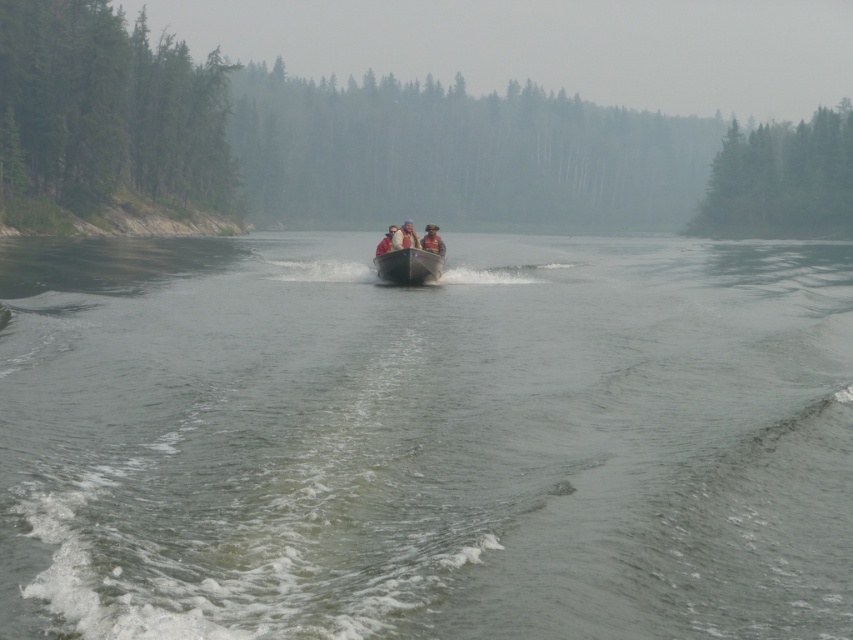
You are a photographer trying to capture a closeup of the light brown leather jacket at center and the orange life vest at center. Since your camera can only focus on one object at a time, which object should you choose to ensure it fills more of the frame?

The light brown leather jacket at center has a larger width than the orange life vest at center, so choosing it will fill more of the frame.

You are a photographer trying to capture the light brown leather jacket at center in your shot. The green matte tree at left is blocking part of your view. Can you estimate if the tree is wider than the jacket?

The green matte tree at left might be wider than the light brown leather jacket at center, so it could be blocking more of the view.

You are a photographer planning to take a photo of the orange life vest at center and the green matte trees at upper center. Which object should you focus on first if you want to capture both in a single shot without moving the camera?

The green matte trees at upper center is bigger than the orange life vest at center, so you should focus on the green matte trees at upper center first to ensure both objects are in clear view.